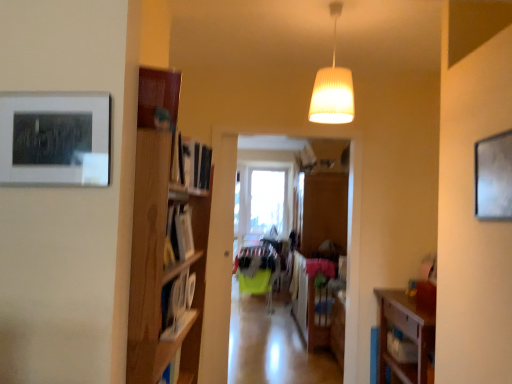
In order to face matte black picture frame at upper left, which appears as the 1th picture frame when viewed from the left, should I rotate leftwards or rightwards?

To face it directly, rotate left by 25.506 degrees.

What do you see at coordinates (55, 138) in the screenshot? I see `matte black picture frame at upper left, positioned as the 2th picture frame in back-to-front order` at bounding box center [55, 138].

Where is `wooden clothes rack at center`? wooden clothes rack at center is located at coordinates (280, 341).

Find the location of a particular element. The image size is (512, 384). white glossy bookshelf at left is located at coordinates (178, 305).

Locate an element on the screen. This screenshot has height=384, width=512. green fabric chair at center is located at coordinates (257, 271).

Find the location of a particular element. matte gray picture frame at upper right, marked as the 2th picture frame in a left-to-right arrangement is located at coordinates (494, 177).

The width and height of the screenshot is (512, 384). I want to click on wooden table at center, so click(x=311, y=300).

Find the location of a particular element. matte black picture frame at upper left, which is the first picture frame from front to back is located at coordinates (55, 138).

From the image's perspective, is white glossy bookshelf at left above or below green fabric chair at center?

Clearly, from the image's perspective, white glossy bookshelf at left is above green fabric chair at center.

Where is `furniture behind the white glossy bookshelf at left`? This screenshot has width=512, height=384. furniture behind the white glossy bookshelf at left is located at coordinates (257, 271).

Can you confirm if white glossy bookshelf at left is positioned to the right of green fabric chair at center?

No, white glossy bookshelf at left is not to the right of green fabric chair at center.

Are white glossy bookshelf at left and green fabric chair at center making contact?

No, white glossy bookshelf at left is not beside green fabric chair at center.

The width and height of the screenshot is (512, 384). I want to click on aisle below the wooden table at center (from the image's perspective), so click(x=273, y=346).

Is wooden floor at center to the left of wooden table at center from the viewer's perspective?

Yes, wooden floor at center is to the left of wooden table at center.

Is wooden floor at center located outside wooden table at center?

wooden floor at center is positioned outside wooden table at center.

Are wooden floor at center and white ribbed lampshade at upper center located far from each other?

wooden floor at center is positioned a significant distance from white ribbed lampshade at upper center.

Which is closer, (255, 317) or (330, 9)?

The point (330, 9) is closer to the camera.

Which of these two, wooden floor at center or white ribbed lampshade at upper center, stands taller?

white ribbed lampshade at upper center is taller.

From the image's perspective, who appears lower, green fabric chair at center or wooden floor at center?

wooden floor at center, from the image's perspective.

From the picture: Measure the distance between green fabric chair at center and wooden floor at center.

green fabric chair at center is 18.71 inches from wooden floor at center.

Is green fabric chair at center positioned with its back to wooden floor at center?

No, green fabric chair at center is not facing the opposite direction of wooden floor at center.

Is green fabric chair at center directly adjacent to wooden floor at center?

No, green fabric chair at center is not beside wooden floor at center.

From a real-world perspective, who is located higher, transparent glass window at center or matte black picture frame at upper left, the 2th picture frame in the right-to-left sequence?

matte black picture frame at upper left, the 2th picture frame in the right-to-left sequence.

Considering the points (283, 230) and (99, 141), which point is in front, point (283, 230) or point (99, 141)?

Point (99, 141)

In the image, there is a matte black picture frame at upper left, which appears as the 1th picture frame when viewed from the left. Identify the location of window below it (from a real-world perspective). Image resolution: width=512 pixels, height=384 pixels. (262, 202).

From the picture: How different are the orientations of transparent glass window at center and matte black picture frame at upper left, which is the first picture frame from front to back, in degrees?

0.493 degrees.

Which object is closer to the camera taking this photo, white glossy bookshelf at left or matte black picture frame at upper left, positioned as the 2th picture frame in back-to-front order?

matte black picture frame at upper left, positioned as the 2th picture frame in back-to-front order, is in front.

Is white glossy bookshelf at left far from matte black picture frame at upper left, which appears as the 1th picture frame when viewed from the left?

That's not correct — white glossy bookshelf at left is a little close to matte black picture frame at upper left, which appears as the 1th picture frame when viewed from the left.

From the image's perspective, between white glossy bookshelf at left and matte black picture frame at upper left, the 2th picture frame in the right-to-left sequence, which one is located above?

From the image's view, matte black picture frame at upper left, the 2th picture frame in the right-to-left sequence, is above.

Does matte black picture frame at upper left, which is the first picture frame from front to back, come behind wooden floor at center?

No, matte black picture frame at upper left, which is the first picture frame from front to back, is closer to the viewer.

From the picture: Does matte black picture frame at upper left, which is the first picture frame from front to back, have a greater width compared to wooden floor at center?

No.

Does matte black picture frame at upper left, which appears as the 1th picture frame when viewed from the left, have a lesser height compared to wooden floor at center?

No, matte black picture frame at upper left, which appears as the 1th picture frame when viewed from the left, is not shorter than wooden floor at center.

Is matte black picture frame at upper left, the 2th picture frame in the right-to-left sequence, beside wooden floor at center?

No, matte black picture frame at upper left, the 2th picture frame in the right-to-left sequence, is not with wooden floor at center.

You are a GUI agent. You are given a task and a screenshot of the screen. Output one action in this format:
    pyautogui.click(x=<x>, y=<y>)
    Task: Click on the furniture behind the white glossy bookshelf at left
    Image resolution: width=512 pixels, height=384 pixels.
    Given the screenshot: What is the action you would take?
    pyautogui.click(x=257, y=271)

Find the location of a particular element. table located above the wooden floor at center (from a real-world perspective) is located at coordinates (311, 300).

When comparing their distances from white glossy bookshelf at left, does matte gray picture frame at upper right, which appears as the first picture frame when viewed from the right, or wooden table at center seem further?

wooden table at center is further to white glossy bookshelf at left.

From the image, which object appears to be nearer to white glossy bookshelf at left, wooden table at center or transparent glass window at center?

Among the two, wooden table at center is located nearer to white glossy bookshelf at left.

Which object lies further to the anchor point matte gray picture frame at upper right, marked as the 2th picture frame in a left-to-right arrangement, white glossy bookshelf at left or wooden clothes rack at center?

The object further to matte gray picture frame at upper right, marked as the 2th picture frame in a left-to-right arrangement, is wooden clothes rack at center.

Which object lies further to the anchor point transparent glass window at center, wooden floor at center or matte gray picture frame at upper right, which appears as the first picture frame when viewed from the right?

Based on the image, matte gray picture frame at upper right, which appears as the first picture frame when viewed from the right, appears to be further to transparent glass window at center.

From the image, which object appears to be nearer to wooden table at center, wooden clothes rack at center or transparent glass window at center?

Based on the image, wooden clothes rack at center appears to be nearer to wooden table at center.

Which object lies nearer to the anchor point wooden floor at center, white glossy bookshelf at left or green fabric chair at center?

green fabric chair at center is positioned closer to the anchor wooden floor at center.

Estimate the real-world distances between objects in this image. Which object is further from white ribbed lampshade at upper center, wooden table at center or matte gray picture frame at upper right, which ranks as the second picture frame in front-to-back order?

wooden table at center lies further to white ribbed lampshade at upper center than the other object.

Based on the photo, estimate the real-world distances between objects in this image. Which object is closer to wooden floor at center, wooden table at center or matte gray picture frame at upper right, which ranks as the second picture frame in front-to-back order?

wooden table at center is closer to wooden floor at center.

Find the location of a particular element. The width and height of the screenshot is (512, 384). aisle located between white glossy bookshelf at left and transparent glass window at center in the depth direction is located at coordinates (273, 346).

Image resolution: width=512 pixels, height=384 pixels. I want to click on picture frame between matte black picture frame at upper left, which is the first picture frame from front to back, and green fabric chair at center, along the z-axis, so click(494, 177).

The width and height of the screenshot is (512, 384). What are the coordinates of `table between matte black picture frame at upper left, positioned as the 2th picture frame in back-to-front order, and transparent glass window at center from front to back` in the screenshot? It's located at (311, 300).

At what (x,y) coordinates should I click in order to perform the action: click on furniture located between wooden table at center and transparent glass window at center in the depth direction. Please return your answer as a coordinate pair (x, y). Image resolution: width=512 pixels, height=384 pixels. Looking at the image, I should click on (257, 271).